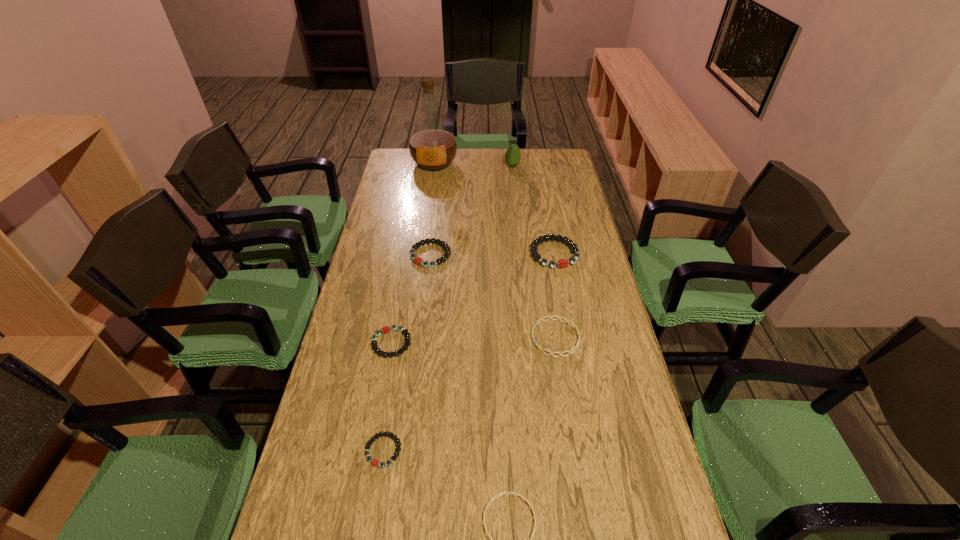
Locate an element on the screen. vacant position located on the right of the second nearest black bracelet is located at coordinates (535, 343).

Identify the location of vacant space located 0.180m on the right of the smallest black bracelet. (474, 450).

You are a GUI agent. You are given a task and a screenshot of the screen. Output one action in this format:
    pyautogui.click(x=<x>, y=<y>)
    Task: Click on the liquor that is at the far edge
    The image size is (960, 540).
    Given the screenshot: What is the action you would take?
    pyautogui.click(x=432, y=145)

Where is `avocado that is at the far edge`? Image resolution: width=960 pixels, height=540 pixels. avocado that is at the far edge is located at coordinates (512, 156).

I want to click on liquor that is at the left edge, so click(432, 145).

You are a GUI agent. You are given a task and a screenshot of the screen. Output one action in this format:
    pyautogui.click(x=<x>, y=<y>)
    Task: Click on the object that is at the far left corner
    The image size is (960, 540).
    Given the screenshot: What is the action you would take?
    pyautogui.click(x=432, y=145)

The width and height of the screenshot is (960, 540). Identify the location of vacant space at the left edge of the desktop. pyautogui.click(x=339, y=452).

At what (x,y) coordinates should I click in order to perform the action: click on blank space at the right edge of the desktop. Please return your answer as a coordinate pair (x, y). Looking at the image, I should click on (635, 479).

Where is `free space between the third farthest black bracelet and the fifth shortest object`? free space between the third farthest black bracelet and the fifth shortest object is located at coordinates (411, 299).

Identify the location of free space between the farther blue bracelet and the biggest black bracelet. (555, 296).